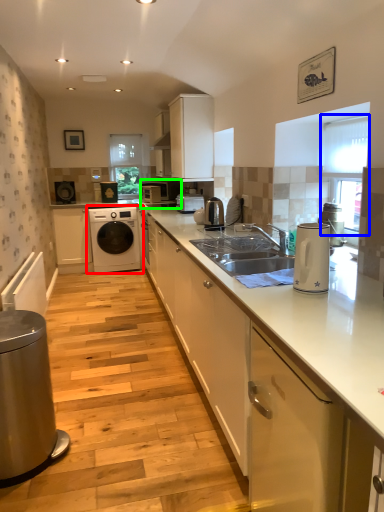
Question: Which is nearer to the washing machine (highlighted by a red box)? window screen (highlighted by a blue box) or home appliance (highlighted by a green box).

Choices:
 (A) window screen
 (B) home appliance

Answer: (B)